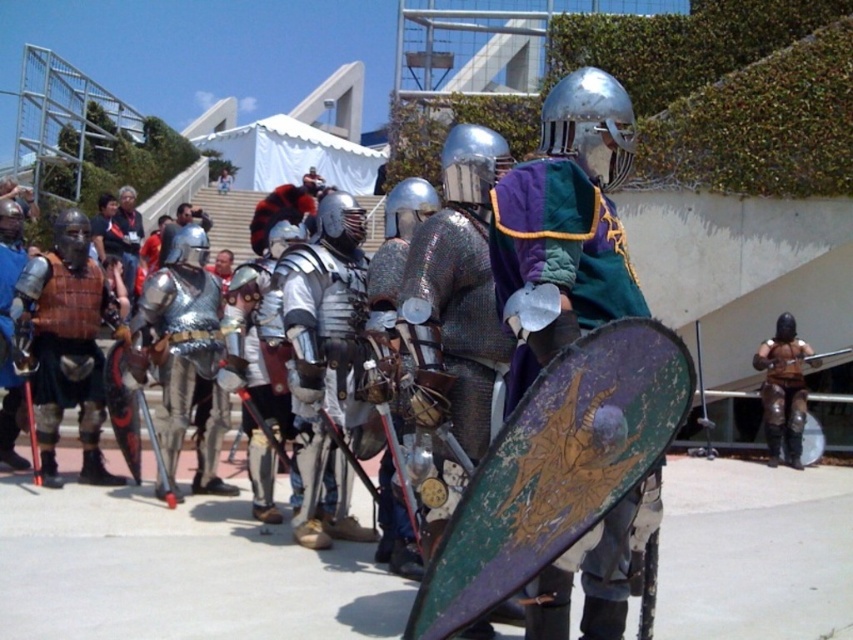
Question: Which point appears closest to the camera in this image?

Choices:
 (A) (791, 333)
 (B) (548, 269)

Answer: (B)

Question: Is shiny silver helmet at center bigger than brown leather armor at right?

Choices:
 (A) no
 (B) yes

Answer: (A)

Question: Which point is closer to the camera?

Choices:
 (A) brown leather armor at right
 (B) shiny silver helmet at center

Answer: (B)

Question: Considering the relative positions of shiny silver helmet at center and brown leather armor at right in the image provided, where is shiny silver helmet at center located with respect to brown leather armor at right?

Choices:
 (A) right
 (B) left

Answer: (B)

Question: Is shiny silver helmet at center positioned behind brown leather armor at right?

Choices:
 (A) no
 (B) yes

Answer: (A)